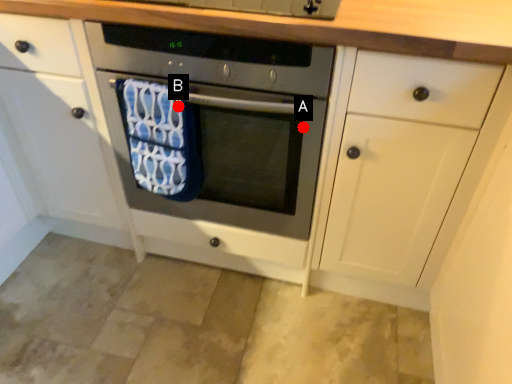
Question: Two points are circled on the image, labeled by A and B beside each circle. Among these points, which one is nearest to the camera?

Choices:
 (A) A is closer
 (B) B is closer

Answer: (B)